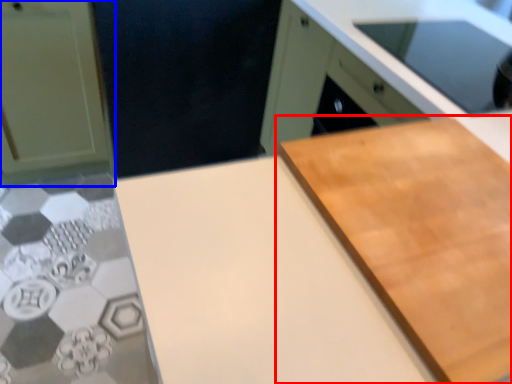
Question: Which point is closer to the camera, cutting board (highlighted by a red box) or cabinetry (highlighted by a blue box)?

Choices:
 (A) cutting board
 (B) cabinetry

Answer: (A)